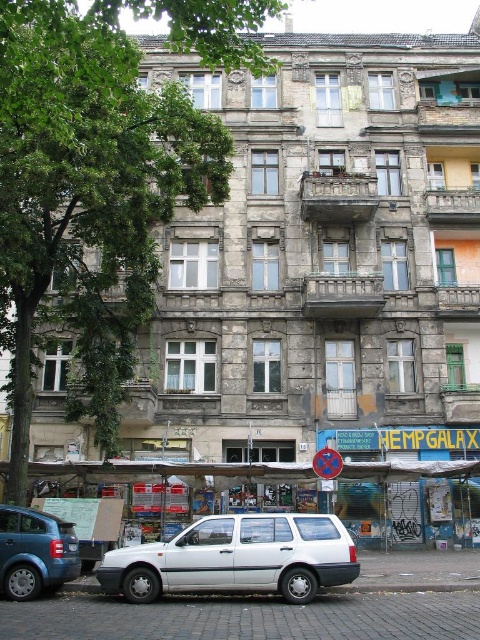
Based on the photo, between white matte car at center and metallic reflective sign at center, which one has less height?

metallic reflective sign at center

The height and width of the screenshot is (640, 480). What are the coordinates of `white matte car at center` in the screenshot? It's located at (237, 557).

Who is lower down, metallic reflective sign at center or white plastic license plate at center?

white plastic license plate at center

Find the location of a particular element. metallic reflective sign at center is located at coordinates (326, 464).

Can you confirm if blue matte hatchback at lower left is positioned to the right of white plastic license plate at center?

In fact, blue matte hatchback at lower left is to the left of white plastic license plate at center.

Which is in front, point (36, 548) or point (76, 547)?

Positioned in front is point (36, 548).

Which is behind, point (44, 541) or point (70, 547)?

The point (70, 547) is more distant.

Where is `blue matte hatchback at lower left`? This screenshot has width=480, height=640. blue matte hatchback at lower left is located at coordinates (35, 552).